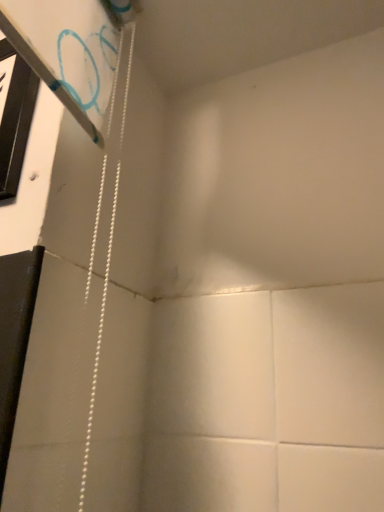
What is the approximate width of black plastic window at left?

black plastic window at left is 0.84 inches wide.

At what (x,y) coordinates should I click in order to perform the action: click on black plastic window at left. Please return your answer as a coordinate pair (x, y). This screenshot has height=512, width=384. Looking at the image, I should click on (14, 116).

What do you see at coordinates (14, 116) in the screenshot? The image size is (384, 512). I see `black plastic window at left` at bounding box center [14, 116].

What is the approximate height of black plastic window at left?

black plastic window at left is 11.46 inches tall.

Identify the location of black plastic window at left. The height and width of the screenshot is (512, 384). (14, 116).